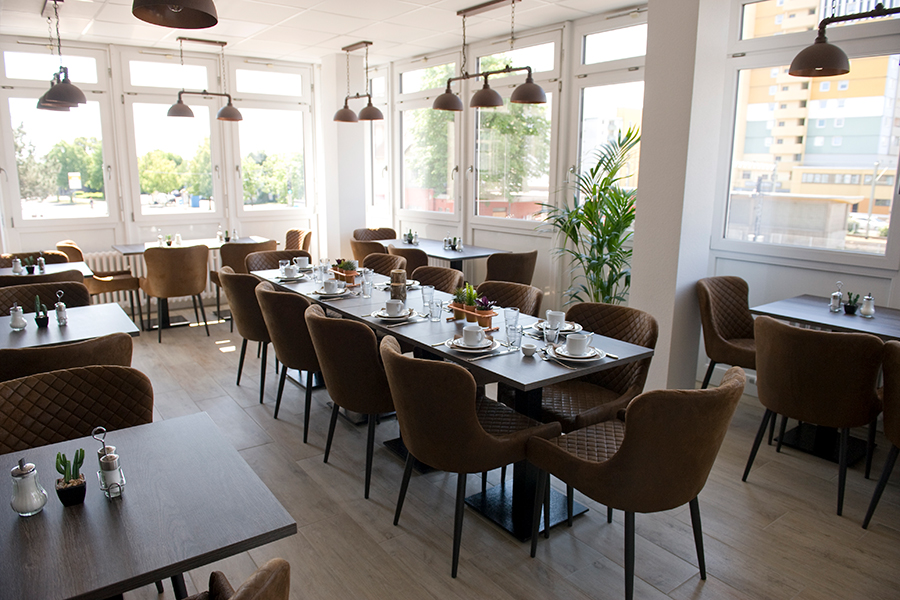
At what (x,y) coordinates should I click in order to perform the action: click on knives. Please return your answer as a coordinate pair (x, y). This screenshot has height=600, width=900. Looking at the image, I should click on (501, 353), (420, 318), (340, 296), (290, 281), (614, 354), (528, 325), (380, 283), (445, 303), (228, 326).